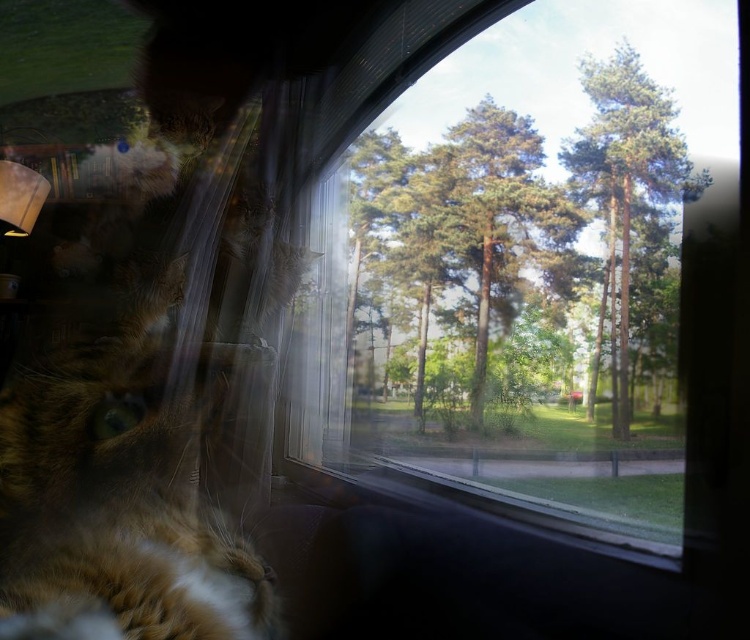
You are standing in the room and want to know where the tabby fur cat at left is located. Can you describe its position relative to the window?

The tabby fur cat at left is positioned near the window, as its 2D coordinates are at point (123,490), which places it in the foreground close to the window.

In the scene shown: You are an interior designer planning to install a new decorative item. You have a choice between placing it on the transparent glass window at center or near the green leafy tree at upper right. Considering their sizes, which location would allow for a larger decorative item?

The transparent glass window at center is larger in size than the green leafy tree at upper right, so placing the decorative item on the transparent glass window at center would allow for a larger decorative item.

You are a delivery robot with a 35 cm wide package. You need to place the package on the transparent glass window at center without blocking the green leafy tree at upper right. Is there enough space between them to do so?

The transparent glass window at center and green leafy tree at upper right are 36.35 centimeters apart. Since the package is 35 cm wide, there is enough space to place it on the window without blocking the tree.